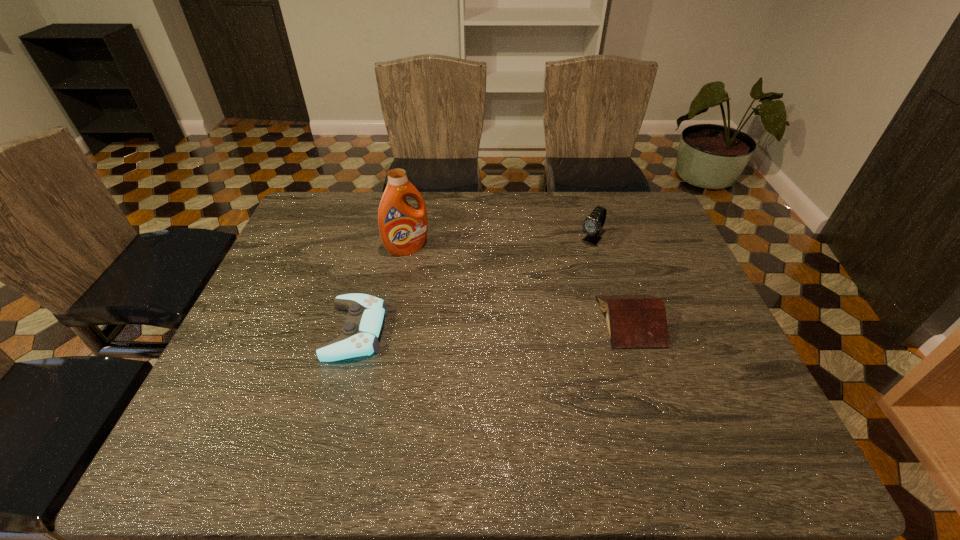
Locate an element on the screen. object that is the third closest one to the control is located at coordinates (592, 225).

The image size is (960, 540). Find the location of `object that is the closest to the control`. object that is the closest to the control is located at coordinates (403, 228).

The width and height of the screenshot is (960, 540). I want to click on vacant space that satisfies the following two spatial constraints: 1. on the back side of the control; 2. on the left side of the second tallest object, so click(380, 240).

Locate an element on the screen. free space in the image that satisfies the following two spatial constraints: 1. on the front side of the watch; 2. on the right side of the book is located at coordinates (615, 321).

This screenshot has width=960, height=540. What are the coordinates of `blank space that satisfies the following two spatial constraints: 1. on the front side of the book; 2. on the right side of the third shortest object` in the screenshot? It's located at point(615,321).

Where is `free spot that satisfies the following two spatial constraints: 1. on the back side of the second tallest object; 2. on the left side of the detergent`? The width and height of the screenshot is (960, 540). free spot that satisfies the following two spatial constraints: 1. on the back side of the second tallest object; 2. on the left side of the detergent is located at coordinates (409, 240).

You are a GUI agent. You are given a task and a screenshot of the screen. Output one action in this format:
    pyautogui.click(x=<x>, y=<y>)
    Task: Click on the free space that satisfies the following two spatial constraints: 1. on the back side of the control; 2. on the right side of the tallest object
    This screenshot has height=540, width=960.
    Given the screenshot: What is the action you would take?
    pyautogui.click(x=377, y=249)

You are a GUI agent. You are given a task and a screenshot of the screen. Output one action in this format:
    pyautogui.click(x=<x>, y=<y>)
    Task: Click on the vacant space that satisfies the following two spatial constraints: 1. on the back side of the third shortest object; 2. on the right side of the detergent
    The image size is (960, 540).
    Given the screenshot: What is the action you would take?
    pyautogui.click(x=409, y=240)